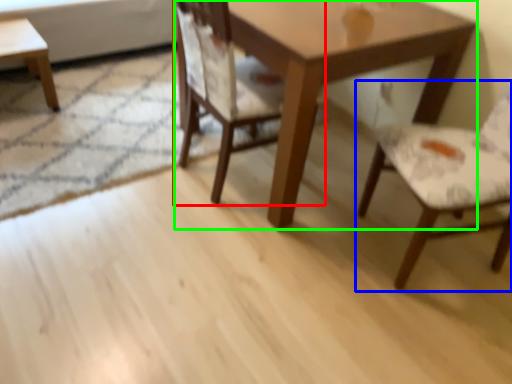
Question: Considering the real-world distances, which object is closest to chair (highlighted by a red box)? chair (highlighted by a blue box) or table (highlighted by a green box).

Choices:
 (A) chair
 (B) table

Answer: (B)